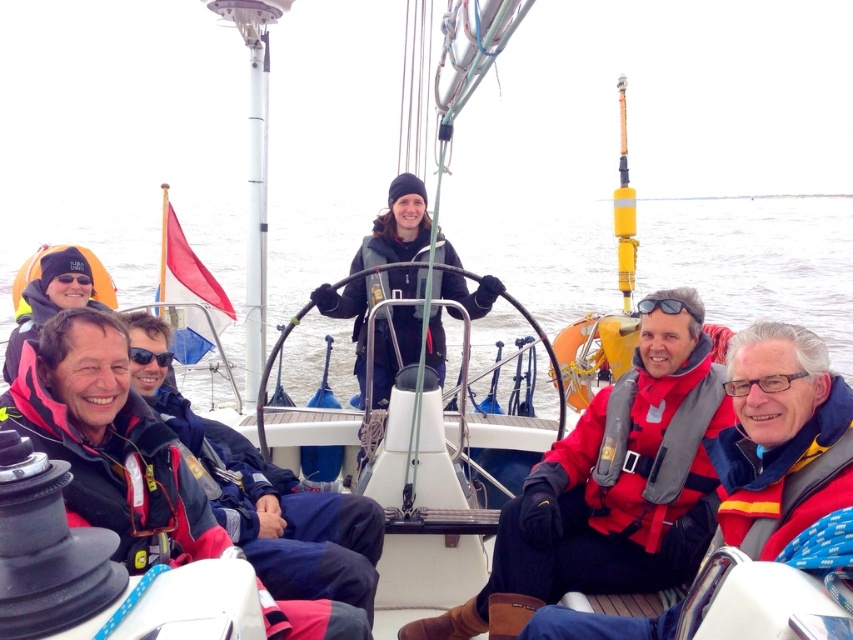
Question: Which of the following is the farthest from the observer?

Choices:
 (A) (68, 256)
 (B) (811, 445)
 (C) (750, 202)

Answer: (C)

Question: Which object appears farthest from the camera in this image?

Choices:
 (A) red matte life jacket at lower right
 (B) red life vest at lower right
 (C) clear water at center
 (D) matte black jacket at center

Answer: (C)

Question: Does red matte life vest at center have a greater width compared to matte black jacket at center?

Choices:
 (A) no
 (B) yes

Answer: (B)

Question: Can you confirm if red matte life vest at center is positioned to the right of pink fleece jacket at lower left?

Choices:
 (A) yes
 (B) no

Answer: (A)

Question: Which of the following is the farthest from the observer?

Choices:
 (A) red matte life jacket at lower right
 (B) red matte life vest at center
 (C) red life vest at lower right
 (D) pink fleece jacket at lower left

Answer: (D)

Question: Does red life vest at lower right appear on the left side of pink fleece jacket at lower left?

Choices:
 (A) yes
 (B) no

Answer: (B)